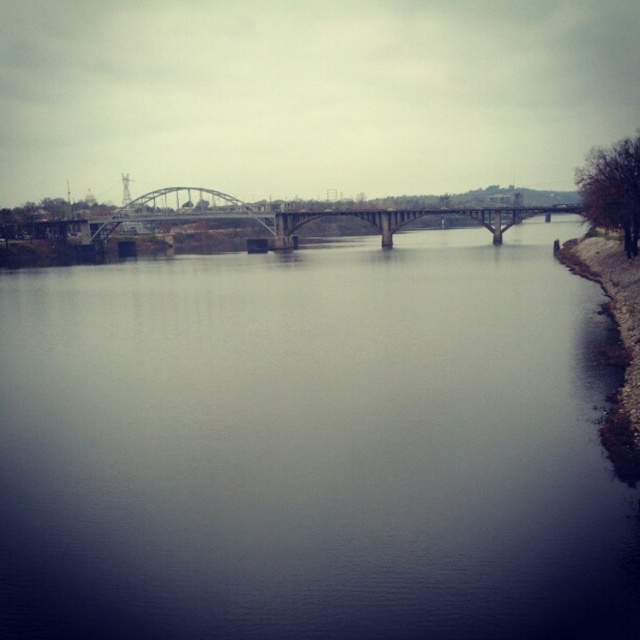
Is gray concrete river at center closer to camera compared to metallic gray bridge at center?

Yes.

Does gray concrete river at center appear on the left side of metallic gray bridge at center?

Correct, you'll find gray concrete river at center to the left of metallic gray bridge at center.

In the scene shown: Who is more forward, (x=481, y=497) or (x=336, y=216)?

Point (x=481, y=497) is in front.

The width and height of the screenshot is (640, 640). I want to click on gray concrete river at center, so click(314, 445).